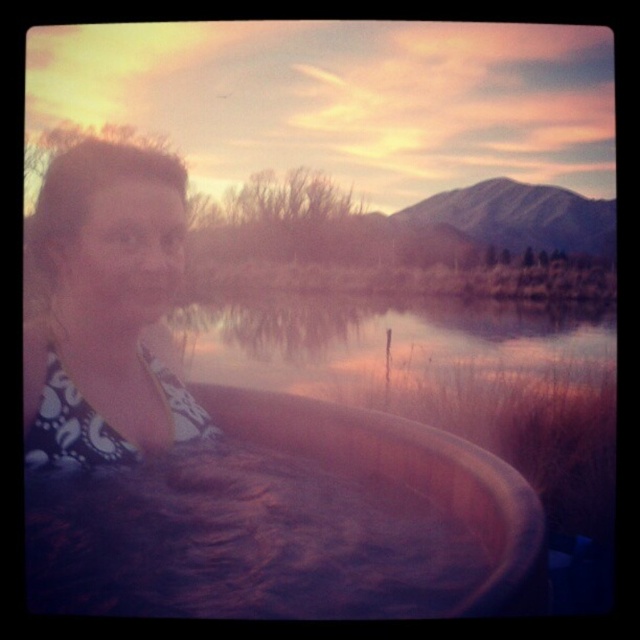
Does brown wooden tub at lower center have a lesser height compared to matte black bikini top at left?

Correct, brown wooden tub at lower center is not as tall as matte black bikini top at left.

Does brown wooden tub at lower center have a lesser width compared to matte black bikini top at left?

Incorrect, brown wooden tub at lower center's width is not less than matte black bikini top at left's.

Is point (204, 387) positioned before point (113, 179)?

No.

At what (x,y) coordinates should I click in order to perform the action: click on brown wooden tub at lower center. Please return your answer as a coordinate pair (x, y). This screenshot has height=640, width=640. Looking at the image, I should click on pos(291,522).

Is brown wooden tub at lower center taller than transparent water at center?

Incorrect, brown wooden tub at lower center's height is not larger of transparent water at center's.

Can you confirm if brown wooden tub at lower center is shorter than transparent water at center?

Yes.

What are the coordinates of `brown wooden tub at lower center` in the screenshot? It's located at (291, 522).

The height and width of the screenshot is (640, 640). I want to click on brown wooden tub at lower center, so pos(291,522).

Who is more distant from viewer, (148,296) or (458,326)?

Point (458,326)

Is point (147, 160) more distant than point (586, 317)?

No, (147, 160) is in front of (586, 317).

What do you see at coordinates (104, 308) in the screenshot? I see `matte black bikini top at left` at bounding box center [104, 308].

Find the location of a particular element. This screenshot has width=640, height=640. matte black bikini top at left is located at coordinates (104, 308).